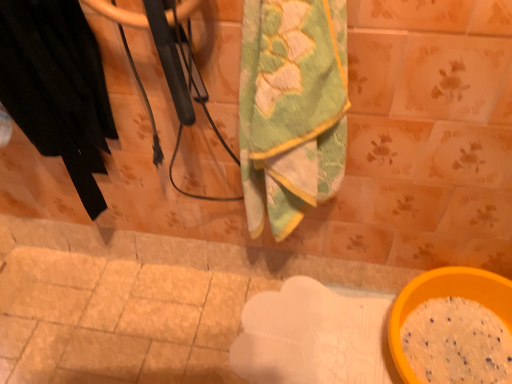
Question: From the image's perspective, is green textured towel at center positioned above or below black fabric at left?

Choices:
 (A) above
 (B) below

Answer: (B)

Question: Looking at the image, does green textured towel at center seem bigger or smaller compared to black fabric at left?

Choices:
 (A) small
 (B) big

Answer: (A)

Question: Estimate the real-world distances between objects in this image. Which object is closer to the yellow plastic bowl at lower right?

Choices:
 (A) green textured towel at center
 (B) black fabric at left

Answer: (A)

Question: Estimate the real-world distances between objects in this image. Which object is farther from the yellow plastic bowl at lower right?

Choices:
 (A) black fabric at left
 (B) green textured towel at center

Answer: (A)